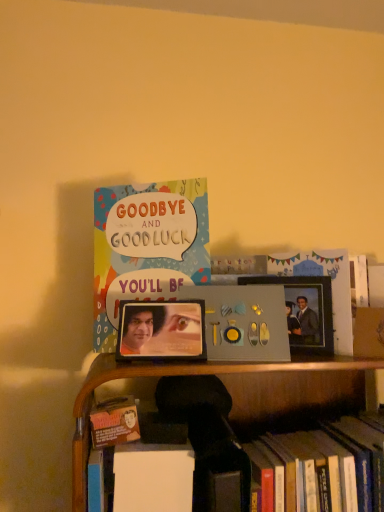
Question: From the image's perspective, would you say hardcover book at lower right, which is the 1th book from right to left, is positioned over metallic photo frame at center, which ranks as the 1th picture frame in front-to-back order?

Choices:
 (A) no
 (B) yes

Answer: (A)

Question: Is the position of hardcover book at lower right, which is the 1th book from right to left, less distant than that of metallic photo frame at center, which is the second picture frame in right-to-left order?

Choices:
 (A) no
 (B) yes

Answer: (B)

Question: Is hardcover book at lower right, which is the 1th book from right to left, further to the viewer compared to metallic photo frame at center, marked as the first picture frame in a left-to-right arrangement?

Choices:
 (A) no
 (B) yes

Answer: (A)

Question: From a real-world perspective, is hardcover book at lower right, the 2th book when ordered from top to bottom, under metallic photo frame at center, which is the second picture frame in right-to-left order?

Choices:
 (A) no
 (B) yes

Answer: (B)

Question: Considering the relative sizes of hardcover book at lower right, the 2th book when ordered from top to bottom, and metallic photo frame at center, marked as the first picture frame in a left-to-right arrangement, in the image provided, is hardcover book at lower right, the 2th book when ordered from top to bottom, bigger than metallic photo frame at center, marked as the first picture frame in a left-to-right arrangement,?

Choices:
 (A) yes
 (B) no

Answer: (A)

Question: From a real-world perspective, is metallic photo frame at center, marked as the first picture frame in a left-to-right arrangement, above or below multicolored paper card at upper center, acting as the second book starting from the bottom?

Choices:
 (A) below
 (B) above

Answer: (A)

Question: In terms of size, does metallic photo frame at center, which is the second picture frame in right-to-left order, appear bigger or smaller than multicolored paper card at upper center, marked as the 1th book in a left-to-right arrangement?

Choices:
 (A) big
 (B) small

Answer: (B)

Question: Visually, is metallic photo frame at center, which ranks as the 1th picture frame in front-to-back order, positioned to the left or to the right of multicolored paper card at upper center, marked as the 1th book in a left-to-right arrangement?

Choices:
 (A) right
 (B) left

Answer: (A)

Question: Is metallic photo frame at center, the 2th picture frame in the back-to-front sequence, taller or shorter than multicolored paper card at upper center, which is counted as the 2th book, starting from the right?

Choices:
 (A) short
 (B) tall

Answer: (A)

Question: In the image, is hardcover book at lower right, the 2th book when ordered from top to bottom, positioned in front of or behind multicolored paper card at upper center, positioned as the 1th book in top-to-bottom order?

Choices:
 (A) behind
 (B) front

Answer: (B)

Question: Is hardcover book at lower right, the 2th book when ordered from top to bottom, wider or thinner than multicolored paper card at upper center, positioned as the 1th book in top-to-bottom order?

Choices:
 (A) wide
 (B) thin

Answer: (A)

Question: Is hardcover book at lower right, the 2th book when ordered from top to bottom, bigger or smaller than multicolored paper card at upper center, which is counted as the 2th book, starting from the right?

Choices:
 (A) big
 (B) small

Answer: (A)

Question: From the image's perspective, is hardcover book at lower right, which is the 2th book from left to right, above or below multicolored paper card at upper center, marked as the 1th book in a left-to-right arrangement?

Choices:
 (A) above
 (B) below

Answer: (B)

Question: Considering their positions, is multicolored paper card at upper center, marked as the 1th book in a left-to-right arrangement, located in front of or behind metallic photo frame at center, the 2th picture frame in the back-to-front sequence?

Choices:
 (A) behind
 (B) front

Answer: (A)

Question: Looking at the image, does multicolored paper card at upper center, marked as the 1th book in a left-to-right arrangement, seem bigger or smaller compared to metallic photo frame at center, which ranks as the 1th picture frame in front-to-back order?

Choices:
 (A) small
 (B) big

Answer: (B)